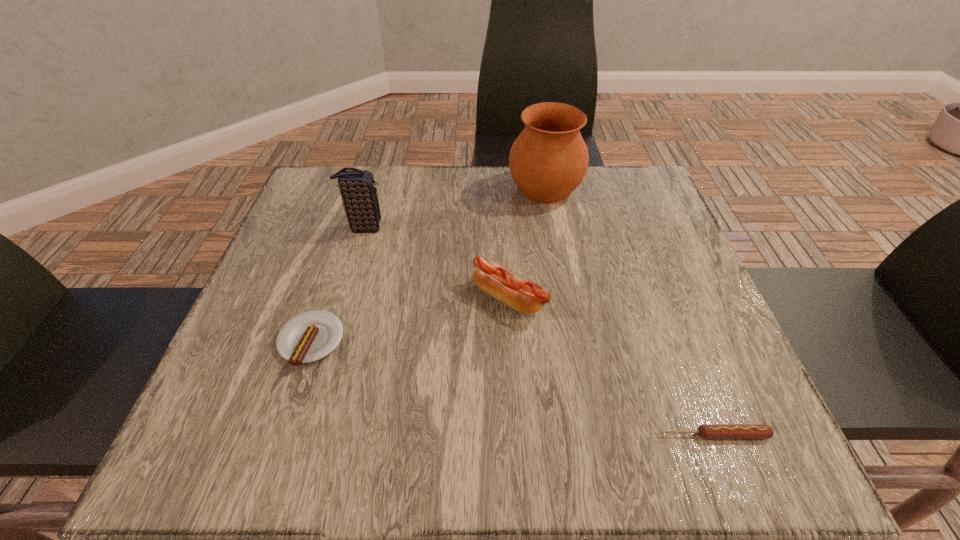
Find the location of a particular element. Image resolution: width=960 pixels, height=540 pixels. free point between the shortest object and the clutch bag is located at coordinates (540, 331).

Where is `blank region between the fourth shortest object and the nearest object`? blank region between the fourth shortest object and the nearest object is located at coordinates (540, 331).

In order to click on free spot between the third tallest object and the nearest object in this screenshot , I will do `click(612, 366)`.

The width and height of the screenshot is (960, 540). What are the coordinates of `vacant area that lies between the leftmost sausage and the pottery` in the screenshot? It's located at (428, 265).

This screenshot has width=960, height=540. Identify the location of vacant space that's between the pottery and the leftmost sausage. (428, 265).

Locate an element on the screen. vacant area that lies between the leftmost sausage and the third shortest object is located at coordinates (410, 320).

I want to click on vacant area that lies between the second farthest object and the farthest object, so click(x=455, y=208).

Locate an element on the screen. This screenshot has width=960, height=540. vacant space that's between the fourth nearest object and the second sausage from right to left is located at coordinates (437, 262).

Identify the location of object that stands as the fourth closest to the clutch bag. (707, 431).

I want to click on object that stands as the fourth closest to the rightmost sausage, so click(x=357, y=187).